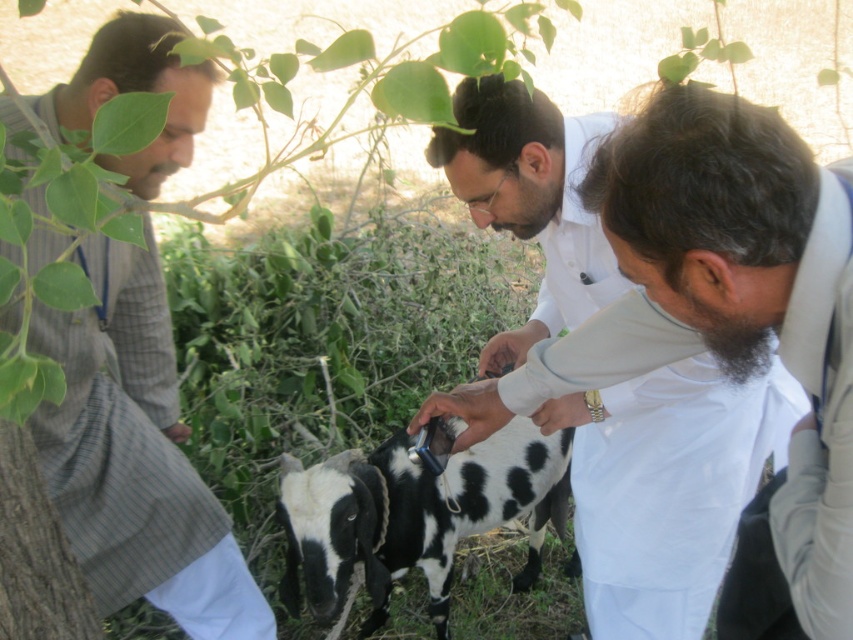
Question: Does white shirt at center appear on the left side of striped fabric shirt at left?

Choices:
 (A) yes
 (B) no

Answer: (B)

Question: Where is green leafy tree at upper left located in relation to black and white spotted goat at center in the image?

Choices:
 (A) right
 (B) left

Answer: (B)

Question: Which point is closer to the camera taking this photo?

Choices:
 (A) (544, 531)
 (B) (131, 378)
 (C) (142, 435)
 (D) (561, 326)

Answer: (C)

Question: Among these objects, which one is nearest to the camera?

Choices:
 (A) white shirt at center
 (B) green leafy tree at upper left

Answer: (B)

Question: Is green leafy tree at upper left below white shirt at center?

Choices:
 (A) yes
 (B) no

Answer: (B)

Question: Among these objects, which one is farthest from the camera?

Choices:
 (A) green leafy tree at upper left
 (B) striped fabric shirt at left

Answer: (B)